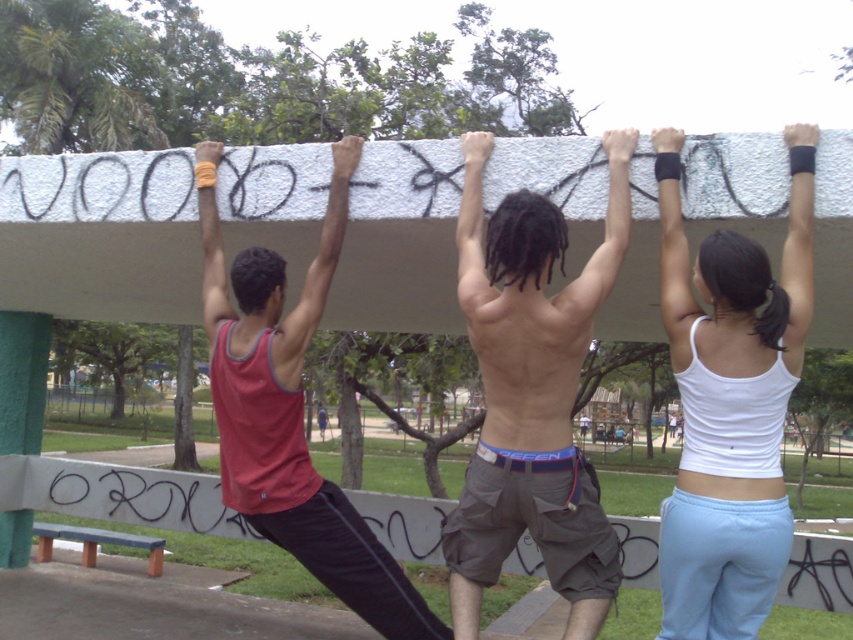
From the picture: Can you confirm if white fabric tank top at upper center is shorter than shiny metallic shorts at center?

Yes, white fabric tank top at upper center is shorter than shiny metallic shorts at center.

Who is taller, white fabric tank top at upper center or shiny metallic shorts at center?

With more height is shiny metallic shorts at center.

This screenshot has width=853, height=640. In order to click on white fabric tank top at upper center in this screenshot , I will do `click(730, 404)`.

Locate an element on the screen. white fabric tank top at upper center is located at coordinates (730, 404).

Is white fabric tank top at upper center shorter than matte red tank top at center?

Indeed, white fabric tank top at upper center has a lesser height compared to matte red tank top at center.

Which is in front, point (740, 403) or point (219, 380)?

Point (740, 403) is in front.

Who is more forward, [683,612] or [318,540]?

Point [683,612]

Identify the location of white fabric tank top at upper center. (730, 404).

Is shiny metallic shorts at center behind matte red tank top at center?

No, it is not.

Can you confirm if shiny metallic shorts at center is positioned to the right of matte red tank top at center?

Indeed, shiny metallic shorts at center is positioned on the right side of matte red tank top at center.

Who is more forward, [589,611] or [244,426]?

Point [589,611] is in front.

The height and width of the screenshot is (640, 853). In order to click on shiny metallic shorts at center in this screenshot , I will do `click(531, 394)`.